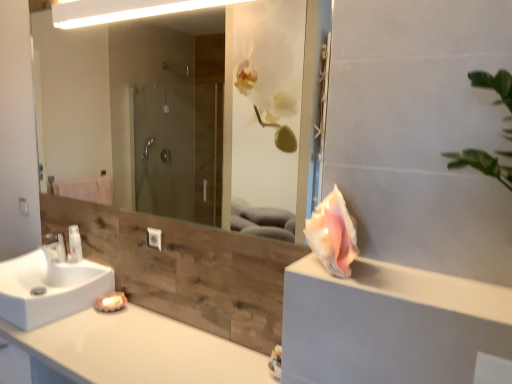
What do you see at coordinates (137, 350) in the screenshot? This screenshot has width=512, height=384. I see `white glossy countertop at lower left` at bounding box center [137, 350].

This screenshot has height=384, width=512. Find the location of `pink shell at right`. pink shell at right is located at coordinates (333, 235).

The width and height of the screenshot is (512, 384). What do you see at coordinates (216, 108) in the screenshot?
I see `transparent glass mirror at upper center` at bounding box center [216, 108].

Locate an element on the screen. This screenshot has height=384, width=512. white glossy light fixture at upper center is located at coordinates (123, 10).

Are white glossy light fixture at upper center and white glossy bottle at left beside each other?

There is a gap between white glossy light fixture at upper center and white glossy bottle at left.

Looking at this image, how distant is white glossy light fixture at upper center from white glossy bottle at left?

They are 1.48 meters apart.

Considering the relative positions of white glossy light fixture at upper center and white glossy bottle at left in the image provided, is white glossy light fixture at upper center to the left of white glossy bottle at left from the viewer's perspective?

Incorrect, white glossy light fixture at upper center is not on the left side of white glossy bottle at left.

Is white glossy light fixture at upper center thinner than white glossy bottle at left?

No.

Is white glossy sink at lower left in front of or behind white glossy countertop at lower left in the image?

In the image, white glossy sink at lower left appears behind white glossy countertop at lower left.

Between white glossy sink at lower left and white glossy countertop at lower left, which one has more height?

white glossy countertop at lower left.

Is white glossy countertop at lower left a part of white glossy sink at lower left?

No, white glossy countertop at lower left is not a part of white glossy sink at lower left.

Between white glossy sink at lower left and white glossy countertop at lower left, which one has larger size?

With larger size is white glossy countertop at lower left.

Is white glossy bottle at left oriented away from pink shell at right?

No, pink shell at right is not at the back of white glossy bottle at left.

Is white glossy bottle at left in front of or behind pink shell at right in the image?

white glossy bottle at left is positioned farther from the viewer than pink shell at right.

From the image's perspective, is white glossy bottle at left on pink shell at right?

No, from the image's perspective, white glossy bottle at left is not on top of pink shell at right.

Based on the photo, from a real-world perspective, who is located lower, white glossy sink at lower left or transparent glass mirror at upper center?

From a 3D spatial view, white glossy sink at lower left is below.

Which is more to the right, white glossy sink at lower left or transparent glass mirror at upper center?

transparent glass mirror at upper center.

Is white glossy sink at lower left touching transparent glass mirror at upper center?

No, white glossy sink at lower left is not in contact with transparent glass mirror at upper center.

Is white glossy sink at lower left turned away from transparent glass mirror at upper center?

No, transparent glass mirror at upper center is not at the back of white glossy sink at lower left.

Is pink shell at right located within white glossy countertop at lower left?

No, pink shell at right is located outside of white glossy countertop at lower left.

Is white glossy countertop at lower left smaller than pink shell at right?

Actually, white glossy countertop at lower left might be larger than pink shell at right.

From a real-world perspective, which is physically above, white glossy countertop at lower left or pink shell at right?

pink shell at right.

From the image's perspective, is white glossy countertop at lower left above or below pink shell at right?

white glossy countertop at lower left is situated lower than pink shell at right in the image.

In terms of height, does transparent glass mirror at upper center look taller or shorter compared to white glossy bottle at left?

Clearly, transparent glass mirror at upper center is taller compared to white glossy bottle at left.

Considering the sizes of objects transparent glass mirror at upper center and white glossy bottle at left in the image provided, who is bigger, transparent glass mirror at upper center or white glossy bottle at left?

transparent glass mirror at upper center is bigger.

Considering the relative sizes of transparent glass mirror at upper center and white glossy bottle at left in the image provided, is transparent glass mirror at upper center thinner than white glossy bottle at left?

Yes.

Are transparent glass mirror at upper center and white glossy bottle at left far apart?

Yes, transparent glass mirror at upper center and white glossy bottle at left are located far from each other.

Considering the relative positions of transparent glass mirror at upper center and pink shell at right in the image provided, is transparent glass mirror at upper center to the left or to the right of pink shell at right?

Clearly, transparent glass mirror at upper center is on the left of pink shell at right in the image.

Is transparent glass mirror at upper center in front of or behind pink shell at right in the image?

In the image, transparent glass mirror at upper center appears behind pink shell at right.

Is transparent glass mirror at upper center far from pink shell at right?

Yes, transparent glass mirror at upper center and pink shell at right are quite far apart.

Locate an element on the screen. light fixture located above the white glossy bottle at left (from the image's perspective) is located at coordinates (123, 10).

Where is `countertop below the white glossy sink at lower left (from a real-world perspective)`? Image resolution: width=512 pixels, height=384 pixels. countertop below the white glossy sink at lower left (from a real-world perspective) is located at coordinates (137, 350).

From the picture: Which object lies further to the anchor point pink shell at right, white glossy sink at lower left or white glossy bottle at left?

Based on the image, white glossy bottle at left appears to be further to pink shell at right.

Estimate the real-world distances between objects in this image. Which object is further from white glossy light fixture at upper center, white glossy countertop at lower left or white glossy sink at lower left?

The object further to white glossy light fixture at upper center is white glossy countertop at lower left.

Looking at this image, considering their positions, is pink shell at right positioned further to transparent glass mirror at upper center than white glossy bottle at left?

The object further to transparent glass mirror at upper center is pink shell at right.

When comparing their distances from white glossy bottle at left, does white glossy countertop at lower left or white glossy light fixture at upper center seem closer?

white glossy countertop at lower left lies closer to white glossy bottle at left than the other object.

From the image, which object appears to be nearer to white glossy bottle at left, white glossy countertop at lower left or white glossy sink at lower left?

white glossy sink at lower left is closer to white glossy bottle at left.

Looking at the image, which one is located closer to white glossy light fixture at upper center, white glossy bottle at left or white glossy faucet at lower left?

The object closer to white glossy light fixture at upper center is white glossy faucet at lower left.

From the image, which object appears to be farther from white glossy bottle at left, pink shell at right or pink shell at right?

Based on the image, pink shell at right appears to be further to white glossy bottle at left.

Estimate the real-world distances between objects in this image. Which object is closer to white glossy faucet at lower left, pink shell at right or white glossy countertop at lower left?

white glossy countertop at lower left lies closer to white glossy faucet at lower left than the other object.

Locate an element on the screen. flower between white glossy light fixture at upper center and pink shell at right vertically is located at coordinates (333, 235).

The image size is (512, 384). I want to click on flower located between white glossy countertop at lower left and pink shell at right in the left-right direction, so click(333, 235).

What are the coordinates of `mirror between white glossy light fixture at upper center and pink shell at right vertically` in the screenshot? It's located at (216, 108).

You are a GUI agent. You are given a task and a screenshot of the screen. Output one action in this format:
    pyautogui.click(x=<x>, y=<y>)
    Task: Click on the flower situated between white glossy bottle at left and pink shell at right from left to right
    
    Given the screenshot: What is the action you would take?
    tap(333, 235)